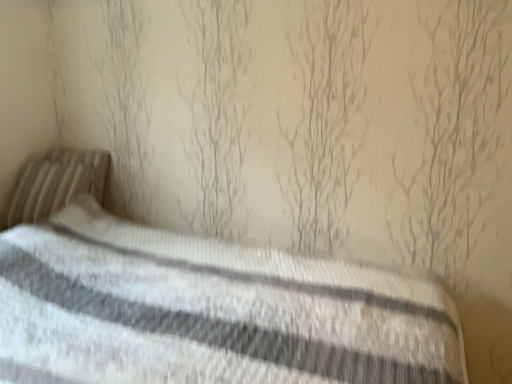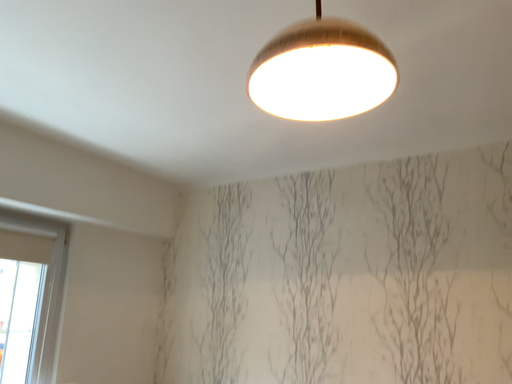
Question: How did the camera likely rotate when shooting the video?

Choices:
 (A) rotated left
 (B) rotated right

Answer: (A)